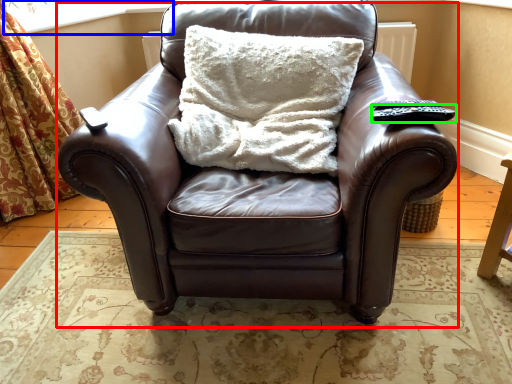
Question: Which object is the farthest from chair (highlighted by a red box)? Choose among these: window screen (highlighted by a blue box) or remote (highlighted by a green box).

Choices:
 (A) window screen
 (B) remote

Answer: (A)